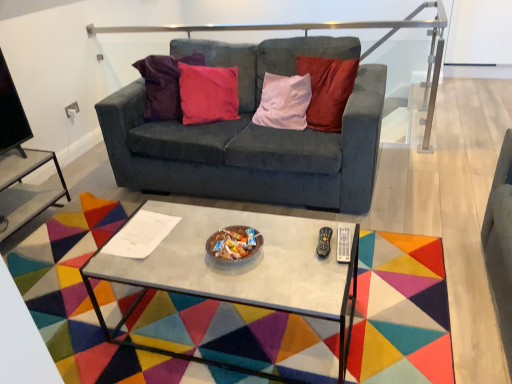
This screenshot has height=384, width=512. Describe the element at coordinates (323, 29) in the screenshot. I see `satin silver rail at upper center` at that location.

Locate an element on the screen. metallic silver side table at lower left is located at coordinates (25, 189).

Describe the element at coordinates (238, 272) in the screenshot. I see `metallic gray coffee table at center` at that location.

Measure the distance between metallic gray coffee table at center and camera.

The depth of metallic gray coffee table at center is 4.54 feet.

In order to click on satin silver rail at upper center in this screenshot , I will do `click(323, 29)`.

Is satin silver rail at upper center far from metallic silver side table at lower left?

That's right, there is a large distance between satin silver rail at upper center and metallic silver side table at lower left.

Considering the relative positions of satin silver rail at upper center and metallic silver side table at lower left in the image provided, is satin silver rail at upper center to the right of metallic silver side table at lower left from the viewer's perspective?

Yes.

Considering the sizes of objects satin silver rail at upper center and metallic silver side table at lower left in the image provided, who is wider, satin silver rail at upper center or metallic silver side table at lower left?

metallic silver side table at lower left.

How many degrees apart are the facing directions of satin silver rail at upper center and metallic silver side table at lower left?

The angular difference between satin silver rail at upper center and metallic silver side table at lower left is 87.6 degrees.

Is metallic gray coffee table at center placed right next to velvet dark gray couch at center?

No, metallic gray coffee table at center is not making contact with velvet dark gray couch at center.

From a real-world perspective, which object rests below the other?

In real-world perspective, metallic gray coffee table at center is lower.

Based on the photo, considering the relative sizes of metallic gray coffee table at center and velvet dark gray couch at center in the image provided, is metallic gray coffee table at center bigger than velvet dark gray couch at center?

Incorrect, metallic gray coffee table at center is not larger than velvet dark gray couch at center.

Locate an element on the screen. studio couch located above the metallic gray coffee table at center (from a real-world perspective) is located at coordinates (252, 135).

Based on their sizes in the image, would you say metallic silver side table at lower left is bigger or smaller than metallic gray coffee table at center?

In the image, metallic silver side table at lower left appears to be smaller than metallic gray coffee table at center.

Does metallic silver side table at lower left have a greater width compared to metallic gray coffee table at center?

Incorrect, the width of metallic silver side table at lower left does not surpass that of metallic gray coffee table at center.

From a real-world perspective, who is located lower, metallic silver side table at lower left or metallic gray coffee table at center?

metallic silver side table at lower left, from a real-world perspective.

This screenshot has height=384, width=512. I want to click on studio couch behind the metallic gray coffee table at center, so click(x=252, y=135).

What's the angular difference between velvet dark gray couch at center and metallic gray coffee table at center's facing directions?

They differ by 89.4 degrees in their facing directions.

Is velvet dark gray couch at center positioned behind metallic gray coffee table at center?

Yes, it is.

Which is in front, point (113, 125) or point (219, 217)?

The point (219, 217) is closer to the camera.

From a real-world perspective, is satin silver rail at upper center below velvet dark gray couch at center?

Actually, satin silver rail at upper center is physically above velvet dark gray couch at center in the real world.

From the image's perspective, is satin silver rail at upper center located beneath velvet dark gray couch at center?

No.

Between satin silver rail at upper center and velvet dark gray couch at center, which one has larger width?

velvet dark gray couch at center is wider.

From the image's perspective, would you say metallic silver side table at lower left is shown under satin silver rail at upper center?

Yes.

From a real-world perspective, who is located higher, metallic silver side table at lower left or satin silver rail at upper center?

satin silver rail at upper center is physically above.

Is metallic silver side table at lower left placed right next to satin silver rail at upper center?

metallic silver side table at lower left and satin silver rail at upper center are clearly separated.

Which is more to the right, metallic silver side table at lower left or satin silver rail at upper center?

satin silver rail at upper center.

How different are the orientations of metallic silver side table at lower left and velvet dark gray couch at center in degrees?

The angle between the facing direction of metallic silver side table at lower left and the facing direction of velvet dark gray couch at center is 87.1 degrees.

Which object is wider, metallic silver side table at lower left or velvet dark gray couch at center?

Wider between the two is velvet dark gray couch at center.

Can we say metallic silver side table at lower left lies outside velvet dark gray couch at center?

Yes, metallic silver side table at lower left is outside of velvet dark gray couch at center.

From the image's perspective, does metallic silver side table at lower left appear higher than velvet dark gray couch at center?

No.

At what (x,y) coordinates should I click in order to perform the action: click on side table that appears below the satin silver rail at upper center (from a real-world perspective). Please return your answer as a coordinate pair (x, y). This screenshot has height=384, width=512. Looking at the image, I should click on (25, 189).

The image size is (512, 384). I want to click on studio couch lying behind the metallic gray coffee table at center, so click(x=252, y=135).

Looking at this image, from the image, which object appears to be nearer to velvet dark gray couch at center, metallic gray coffee table at center or metallic silver side table at lower left?

metallic gray coffee table at center is closer to velvet dark gray couch at center.

Estimate the real-world distances between objects in this image. Which object is further from metallic gray coffee table at center, velvet dark gray couch at center or satin silver rail at upper center?

Based on the image, satin silver rail at upper center appears to be further to metallic gray coffee table at center.

When comparing their distances from metallic gray coffee table at center, does velvet dark gray couch at center or metallic silver side table at lower left seem further?

The object further to metallic gray coffee table at center is metallic silver side table at lower left.

From the image, which object appears to be nearer to velvet dark gray couch at center, metallic silver side table at lower left or satin silver rail at upper center?

Answer: Based on the image, metallic silver side table at lower left appears to be nearer to velvet dark gray couch at center.

Considering their positions, is metallic gray coffee table at center positioned further to satin silver rail at upper center than metallic silver side table at lower left?

metallic gray coffee table at center is further to satin silver rail at upper center.

When comparing their distances from metallic gray coffee table at center, does satin silver rail at upper center or metallic silver side table at lower left seem closer?

metallic silver side table at lower left is positioned closer to the anchor metallic gray coffee table at center.

Which object lies further to the anchor point satin silver rail at upper center, velvet dark gray couch at center or metallic silver side table at lower left?

metallic silver side table at lower left.

From the image, which object appears to be farther from velvet dark gray couch at center, satin silver rail at upper center or metallic silver side table at lower left?

satin silver rail at upper center is positioned further to the anchor velvet dark gray couch at center.

The height and width of the screenshot is (384, 512). I want to click on studio couch between satin silver rail at upper center and metallic gray coffee table at center in the vertical direction, so click(x=252, y=135).

Find the location of a particular element. coffee table between metallic silver side table at lower left and satin silver rail at upper center in the horizontal direction is located at coordinates (238, 272).

In order to click on studio couch between metallic silver side table at lower left and satin silver rail at upper center in the horizontal direction in this screenshot , I will do tap(252, 135).

This screenshot has width=512, height=384. Find the location of `coffee table between metallic silver side table at lower left and velvet dark gray couch at center in the horizontal direction`. coffee table between metallic silver side table at lower left and velvet dark gray couch at center in the horizontal direction is located at coordinates (x=238, y=272).